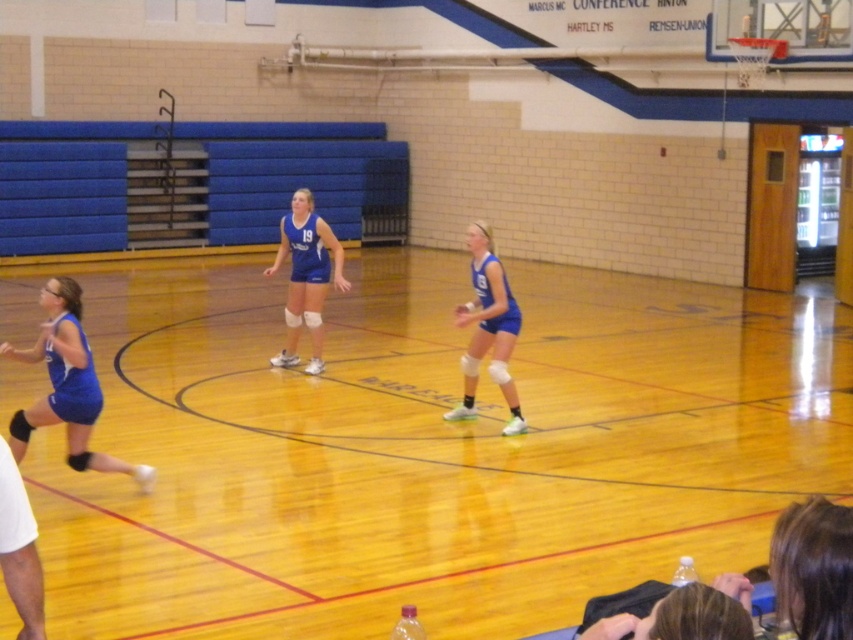
Measure the distance from blue matte volleyball player at center to blue matte volleyball uniform at center.

blue matte volleyball player at center is 3.63 meters away from blue matte volleyball uniform at center.

Does blue matte volleyball player at center have a larger size compared to blue matte volleyball uniform at center?

Correct, blue matte volleyball player at center is larger in size than blue matte volleyball uniform at center.

Between point (461, 310) and point (291, 266), which one is positioned in front?

Point (461, 310) is more forward.

You are a GUI agent. You are given a task and a screenshot of the screen. Output one action in this format:
    pyautogui.click(x=<x>, y=<y>)
    Task: Click on the blue matte volleyball player at center
    The height and width of the screenshot is (640, 853).
    Given the screenshot: What is the action you would take?
    pyautogui.click(x=488, y=328)

Can you confirm if matte blue shorts at left is taller than blue matte volleyball player at center?

In fact, matte blue shorts at left may be shorter than blue matte volleyball player at center.

Can you confirm if matte blue shorts at left is positioned to the right of blue matte volleyball player at center?

In fact, matte blue shorts at left is to the left of blue matte volleyball player at center.

Is point (68, 428) closer to viewer compared to point (479, 326)?

Yes, it is.

What are the coordinates of `matte blue shorts at left` in the screenshot? It's located at (67, 385).

Does matte blue shorts at left appear under blue matte volleyball uniform at center?

Yes, matte blue shorts at left is below blue matte volleyball uniform at center.

In the scene shown: Which is above, matte blue shorts at left or blue matte volleyball uniform at center?

blue matte volleyball uniform at center is higher up.

Between point (59, 321) and point (288, 324), which one is positioned in front?

Point (59, 321)

Find the location of a particular element. The width and height of the screenshot is (853, 640). matte blue shorts at left is located at coordinates (67, 385).